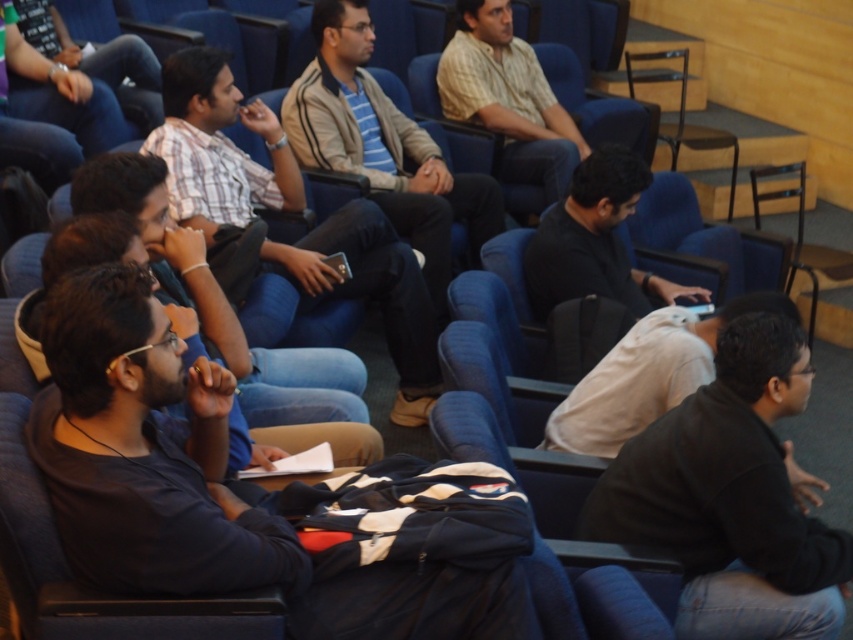
Does plaid shirt at center have a smaller size compared to black matte shirt at center?

No.

Consider the image. Is plaid shirt at center wider than black matte shirt at center?

Yes, plaid shirt at center is wider than black matte shirt at center.

Image resolution: width=853 pixels, height=640 pixels. What are the coordinates of `plaid shirt at center` in the screenshot? It's located at (218, 145).

This screenshot has height=640, width=853. I want to click on plaid shirt at center, so click(x=218, y=145).

Between black matte jacket at lower right and striped knit sweater at center, which one appears on the right side from the viewer's perspective?

black matte jacket at lower right is more to the right.

Locate an element on the screen. The image size is (853, 640). black matte jacket at lower right is located at coordinates (730, 497).

Locate an element on the screen. Image resolution: width=853 pixels, height=640 pixels. black matte jacket at lower right is located at coordinates 730,497.

Is striped knit sweater at center positioned behind white matte shirt at center?

Yes.

Between point (419, 204) and point (627, 356), which one is positioned in front?

Point (627, 356) is more forward.

You are a GUI agent. You are given a task and a screenshot of the screen. Output one action in this format:
    pyautogui.click(x=<x>, y=<y>)
    Task: Click on the striped knit sweater at center
    The height and width of the screenshot is (640, 853).
    Given the screenshot: What is the action you would take?
    pyautogui.click(x=383, y=145)